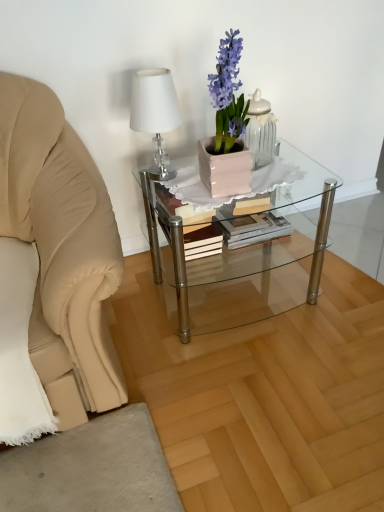
The height and width of the screenshot is (512, 384). In order to click on unoccupied region to the right of clear glass coffee table at center in this screenshot , I will do `click(341, 286)`.